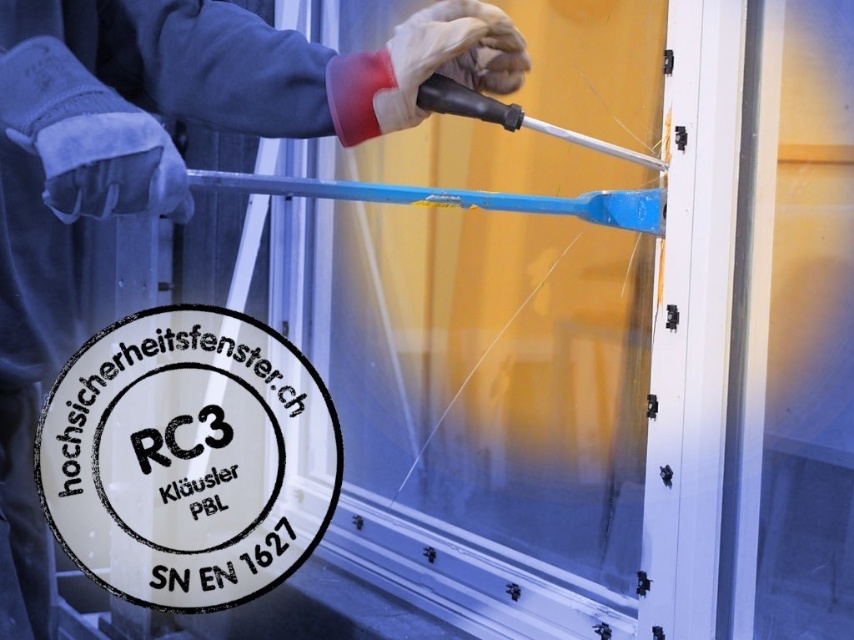
Question: Is blue plastic tool at upper center to the right of white leather glove at upper center from the viewer's perspective?

Choices:
 (A) no
 (B) yes

Answer: (A)

Question: Which point is closer to the camera?

Choices:
 (A) blue plastic tool at upper center
 (B) white leather glove at upper center

Answer: (A)

Question: Does blue plastic tool at upper center appear on the left side of white leather glove at upper center?

Choices:
 (A) no
 (B) yes

Answer: (B)

Question: Which object appears farthest from the camera in this image?

Choices:
 (A) blue plastic tool at upper center
 (B) white leather glove at upper center

Answer: (B)

Question: Can you confirm if blue plastic tool at upper center is positioned to the left of white leather glove at upper center?

Choices:
 (A) no
 (B) yes

Answer: (B)